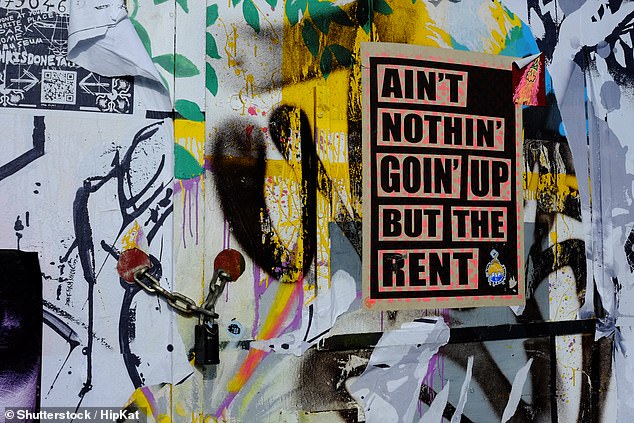
At what (x,y) coordinates should I click in order to perform the action: click on yellow paint. Please return your answer as a coordinate pair (x, y). Looking at the image, I should click on (333, 100).